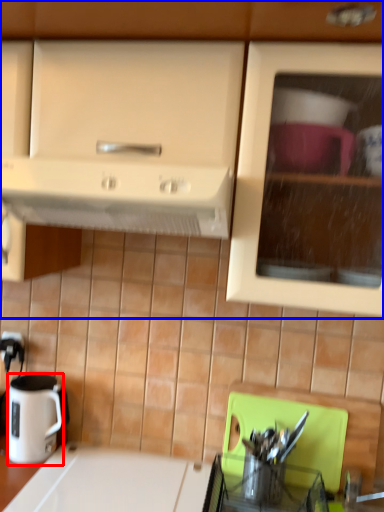
Question: Which point is further to the camera, coffee cup (highlighted by a red box) or cabinetry (highlighted by a blue box)?

Choices:
 (A) coffee cup
 (B) cabinetry

Answer: (A)